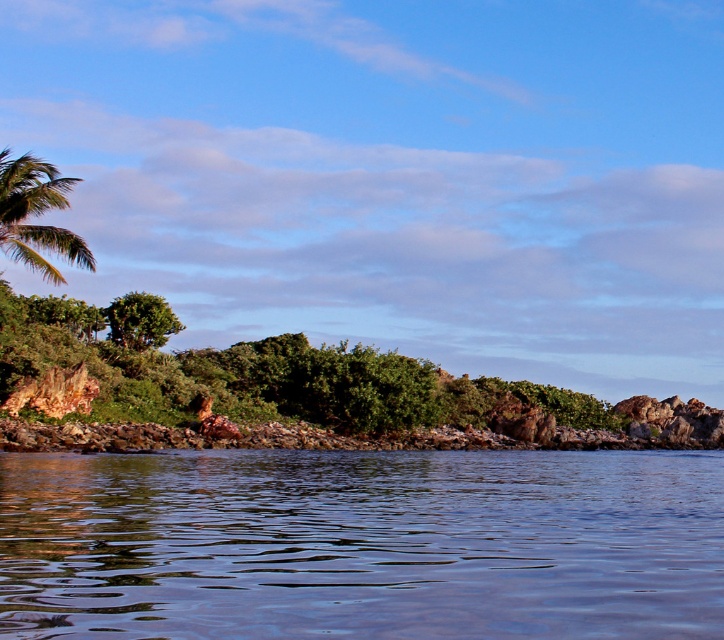
You are a bird flying over the coastal scene. You see the transparent water at center and the green leafy palm tree at upper left. Which object is taller from your perspective?

The green leafy palm tree at upper left is taller than the transparent water at center.

You are a bird flying over the coastal area and want to land on the transparent water at center. Which direction should you fly from the green leafy palm tree at upper left to reach it?

The transparent water at center is located below the green leafy palm tree at upper left, so you should fly downward from the green leafy palm tree at upper left to reach the transparent water at center.

Based on the photo, you are a photographer trying to capture the palm tree and the water in the same shot. Based on the scene, which object is closer to you, the transparent water at center or the green leafy palm tree at upper left?

The transparent water at center is closer to you because it is in front of the green leafy palm tree at upper left in the scene.